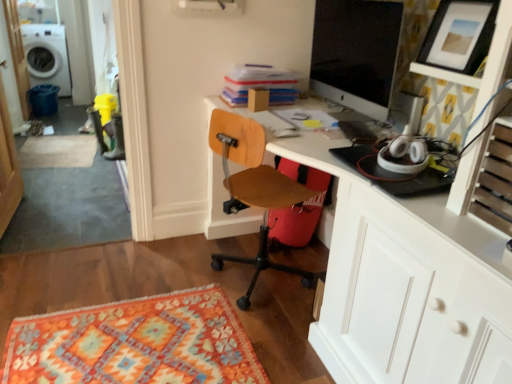
Question: Can you confirm if woodenchair at center is smaller than matte black monitor at upper right?

Choices:
 (A) yes
 (B) no

Answer: (B)

Question: Could matte black monitor at upper right be considered to be inside woodenchair at center?

Choices:
 (A) yes
 (B) no

Answer: (B)

Question: From the image's perspective, is woodenchair at center on matte black monitor at upper right?

Choices:
 (A) yes
 (B) no

Answer: (B)

Question: Would you say woodenchair at center is a long distance from matte black monitor at upper right?

Choices:
 (A) yes
 (B) no

Answer: (B)

Question: Could you tell me if woodenchair at center is facing matte black monitor at upper right?

Choices:
 (A) yes
 (B) no

Answer: (B)

Question: Is woodenchair at center not inside matte black monitor at upper right?

Choices:
 (A) yes
 (B) no

Answer: (A)

Question: From a real-world perspective, does matte black picture frame at upper right stand above beige carpet at lower left, acting as the second mat starting from the right?

Choices:
 (A) yes
 (B) no

Answer: (A)

Question: From the image's perspective, does matte black picture frame at upper right appear higher than beige carpet at lower left, positioned as the 1th mat in top-to-bottom order?

Choices:
 (A) yes
 (B) no

Answer: (A)

Question: Is matte black picture frame at upper right directly adjacent to beige carpet at lower left, arranged as the second mat when ordered from the bottom?

Choices:
 (A) yes
 (B) no

Answer: (B)

Question: Is matte black picture frame at upper right further to the viewer compared to beige carpet at lower left, arranged as the second mat when ordered from the bottom?

Choices:
 (A) no
 (B) yes

Answer: (A)

Question: Would you consider matte black picture frame at upper right to be distant from beige carpet at lower left, positioned as the 1th mat in top-to-bottom order?

Choices:
 (A) yes
 (B) no

Answer: (A)

Question: Considering the relative positions of matte black picture frame at upper right and beige carpet at lower left, placed as the second mat when sorted from front to back, in the image provided, is matte black picture frame at upper right to the right of beige carpet at lower left, placed as the second mat when sorted from front to back, from the viewer's perspective?

Choices:
 (A) yes
 (B) no

Answer: (A)

Question: Considering the relative sizes of white glossy washing machine at upper left and woodenchair at center in the image provided, is white glossy washing machine at upper left smaller than woodenchair at center?

Choices:
 (A) yes
 (B) no

Answer: (B)